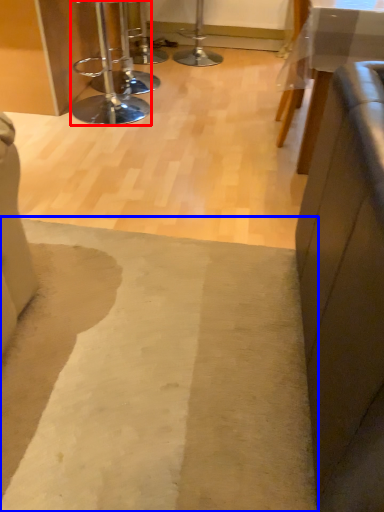
Question: Which of the following is the farthest to the observer, stool (highlighted by a red box) or mat (highlighted by a blue box)?

Choices:
 (A) stool
 (B) mat

Answer: (A)